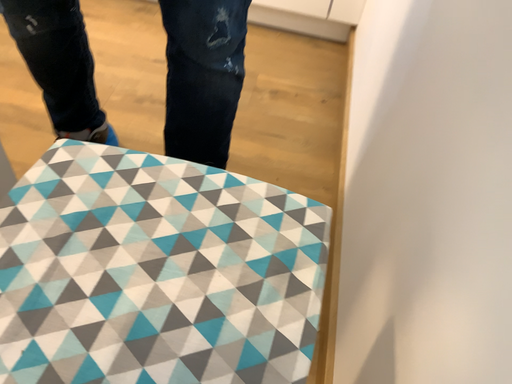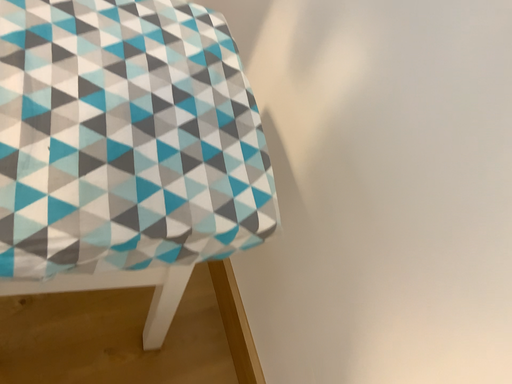
Question: Which way did the camera rotate in the video?

Choices:
 (A) rotated left
 (B) rotated right

Answer: (B)